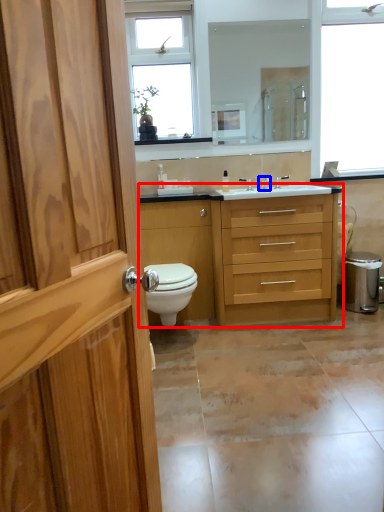
Question: Which object is further to the camera taking this photo, bathroom cabinet (highlighted by a red box) or tap (highlighted by a blue box)?

Choices:
 (A) bathroom cabinet
 (B) tap

Answer: (B)